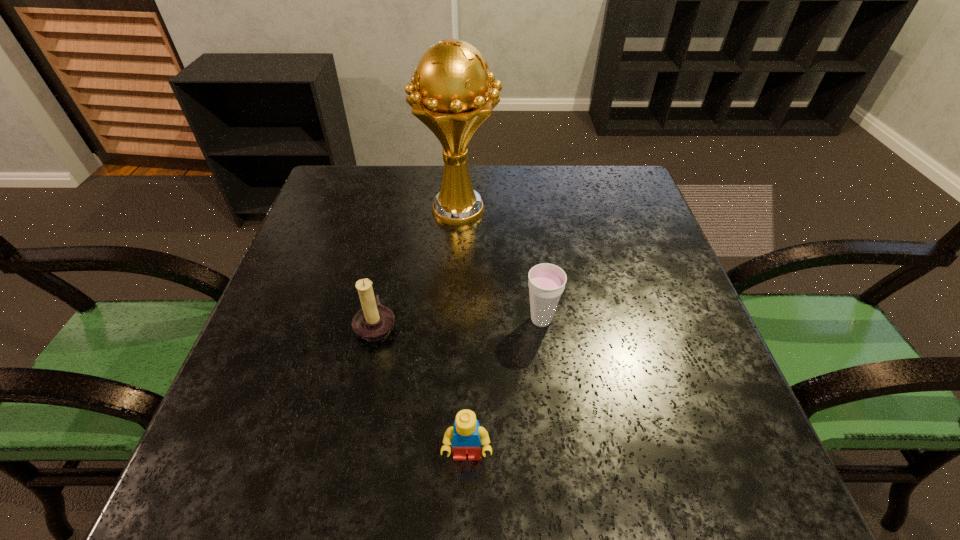
Locate an element on the screen. The width and height of the screenshot is (960, 540). empty space that is in between the Lego and the trophy_cup is located at coordinates (463, 333).

The width and height of the screenshot is (960, 540). I want to click on unoccupied area between the tallest object and the leftmost object, so [x=418, y=267].

Locate an element on the screen. The width and height of the screenshot is (960, 540). free spot between the Lego and the leftmost object is located at coordinates (421, 390).

Where is `free space between the cup and the tallest object`? Image resolution: width=960 pixels, height=540 pixels. free space between the cup and the tallest object is located at coordinates (500, 265).

Find the location of a particular element. free space between the farthest object and the cup is located at coordinates (500, 265).

What are the coordinates of `object that is the second closest to the nearest object` in the screenshot? It's located at (546, 283).

Identify the location of object that stands as the closest to the cup. The image size is (960, 540). (x=450, y=92).

Identify the location of vacant region that satisfies the following two spatial constraints: 1. at the front of the cup where the globe is prominent; 2. on the left side of the farthest object. The image size is (960, 540). (452, 320).

Find the location of a particular element. This screenshot has width=960, height=540. free location that satisfies the following two spatial constraints: 1. at the front of the trophy_cup where the globe is prominent; 2. on the wick of the leftmost object is located at coordinates [452, 324].

Locate an element on the screen. The width and height of the screenshot is (960, 540). free space that satisfies the following two spatial constraints: 1. at the front of the cup where the globe is prominent; 2. on the left side of the tallest object is located at coordinates (452, 320).